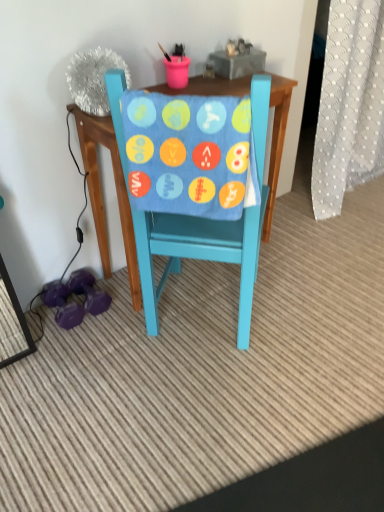
Where is `vacant space situated on the left part of teal painted wood chair at center`? The width and height of the screenshot is (384, 512). vacant space situated on the left part of teal painted wood chair at center is located at coordinates (87, 348).